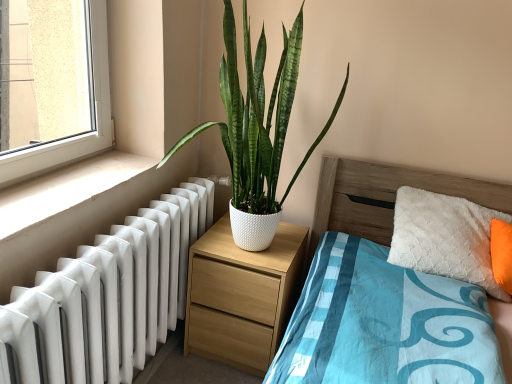
Question: Considering the relative sizes of white smooth window sill at lower left and wooden bed at center in the image provided, is white smooth window sill at lower left smaller than wooden bed at center?

Choices:
 (A) yes
 (B) no

Answer: (A)

Question: From a real-world perspective, is white smooth window sill at lower left located beneath wooden bed at center?

Choices:
 (A) yes
 (B) no

Answer: (B)

Question: Can you confirm if white smooth window sill at lower left is shorter than wooden bed at center?

Choices:
 (A) no
 (B) yes

Answer: (B)

Question: From the image's perspective, would you say white smooth window sill at lower left is positioned over wooden bed at center?

Choices:
 (A) no
 (B) yes

Answer: (B)

Question: Is white smooth window sill at lower left beside wooden bed at center?

Choices:
 (A) yes
 (B) no

Answer: (B)

Question: Does white smooth window sill at lower left lie in front of wooden bed at center?

Choices:
 (A) no
 (B) yes

Answer: (A)

Question: Considering the relative sizes of light wood/texture nightstand at center and white glossy radiator at left in the image provided, is light wood/texture nightstand at center wider than white glossy radiator at left?

Choices:
 (A) yes
 (B) no

Answer: (B)

Question: Is light wood/texture nightstand at center positioned behind white glossy radiator at left?

Choices:
 (A) no
 (B) yes

Answer: (B)

Question: Considering the relative sizes of light wood/texture nightstand at center and white glossy radiator at left in the image provided, is light wood/texture nightstand at center thinner than white glossy radiator at left?

Choices:
 (A) yes
 (B) no

Answer: (A)

Question: Can you confirm if light wood/texture nightstand at center is taller than white glossy radiator at left?

Choices:
 (A) no
 (B) yes

Answer: (A)

Question: From a real-world perspective, is light wood/texture nightstand at center on white glossy radiator at left?

Choices:
 (A) yes
 (B) no

Answer: (B)

Question: Considering the relative positions of light wood/texture nightstand at center and white glossy radiator at left in the image provided, is light wood/texture nightstand at center to the left of white glossy radiator at left from the viewer's perspective?

Choices:
 (A) yes
 (B) no

Answer: (B)

Question: Can you confirm if white smooth window sill at lower left is positioned to the right of white glossy radiator at left?

Choices:
 (A) no
 (B) yes

Answer: (A)